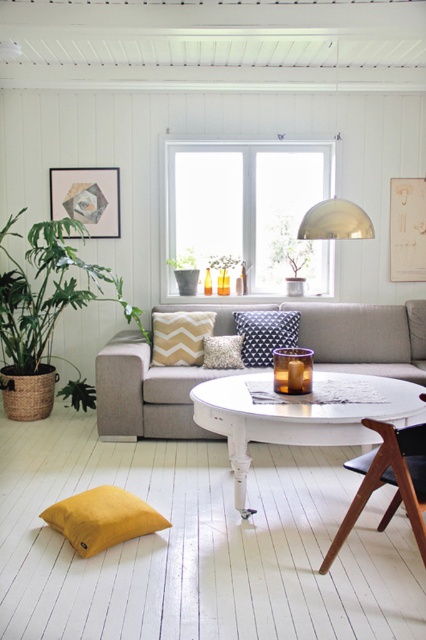
Question: Which of these objects is positioned farthest from the textured cream pillow at center?

Choices:
 (A) white painted wood table at center
 (B) teak wood chair at center

Answer: (B)

Question: Can you confirm if white glass window at center is wider than teak wood chair at center?

Choices:
 (A) no
 (B) yes

Answer: (B)

Question: Which is nearer to the polished brass dome at upper center?

Choices:
 (A) white painted wood table at center
 (B) white glass window at center

Answer: (A)

Question: Does beige chevron-patterned pillow at center appear under polished brass dome at upper center?

Choices:
 (A) no
 (B) yes

Answer: (B)

Question: Which object is positioned closest to the polished brass dome at upper center?

Choices:
 (A) green leafy plant in woven pot at left
 (B) navy blue textured pillow at center
 (C) mustard yellow cushion at lower left

Answer: (B)

Question: Is white painted wood table at center positioned behind teak wood chair at center?

Choices:
 (A) yes
 (B) no

Answer: (A)